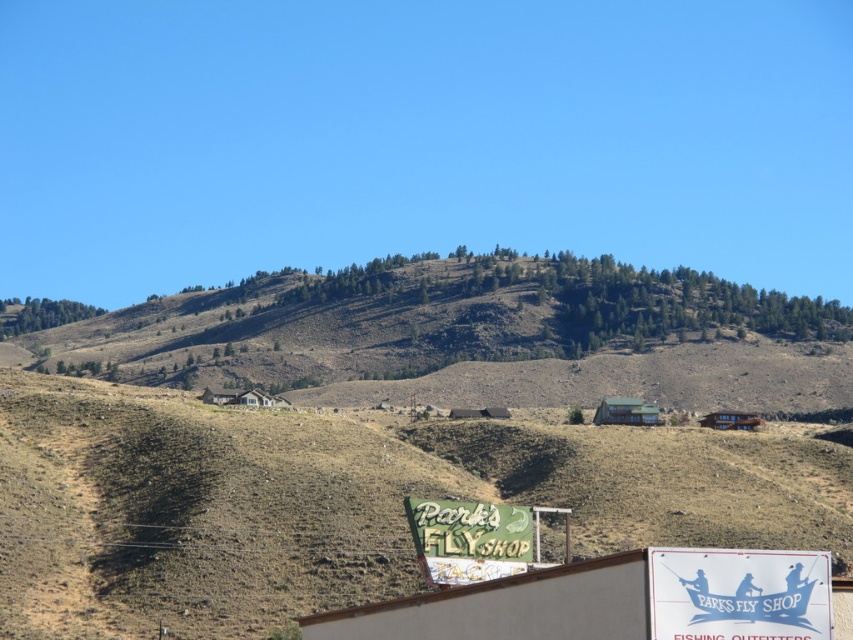
You are a visitor at the Park Fly Shop and want to read both the white paper sign at lower center and the green painted wood sign at lower center. Which sign should you look to your left to read first?

The white paper sign at lower center is positioned on the right side of green painted wood sign at lower center, so you should look to your left to read the green painted wood sign at lower center first.

Based on the photo, you are standing at the bottom of the scene and want to reach the green textured hillside at upper center. Which direction should you move relative to the green painted wood sign at lower center?

To reach the green textured hillside at upper center from the green painted wood sign at lower center, you should move upward since the hillside is above the sign.